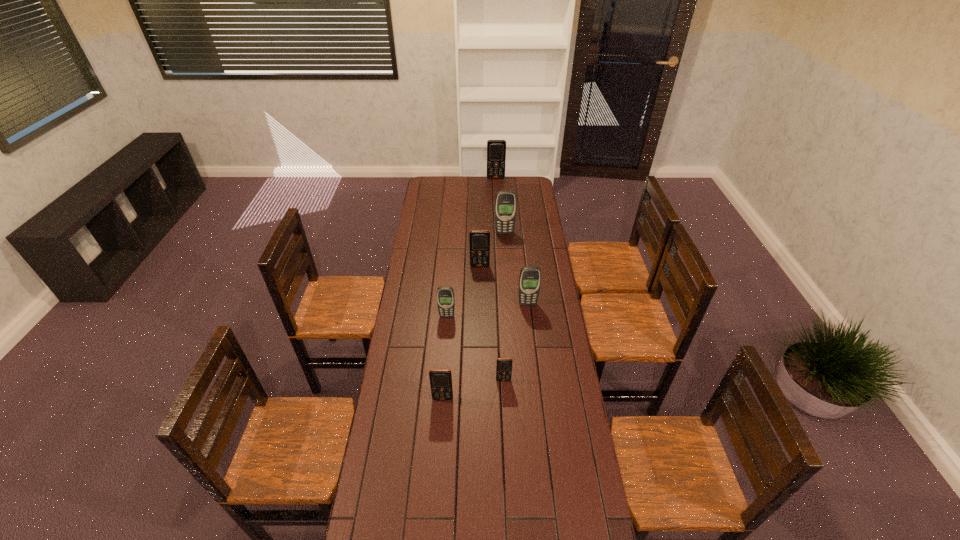
Where is `free space between the fourth nearest cellular telephone and the smallest orange cellular telephone`? free space between the fourth nearest cellular telephone and the smallest orange cellular telephone is located at coordinates (516, 342).

This screenshot has width=960, height=540. Find the location of `unoccupied area between the leftmost gray cellular telephone and the leftmost orange cellular telephone`. unoccupied area between the leftmost gray cellular telephone and the leftmost orange cellular telephone is located at coordinates (444, 357).

In order to click on empty location between the farthest cellular telephone and the second biggest orange cellular telephone in this screenshot , I will do `click(488, 222)`.

Find the location of a particular element. The image size is (960, 540). object that is the second closest one to the second farthest orange cellular telephone is located at coordinates (530, 276).

Where is `object that ranks as the closest to the farthest gray cellular telephone`? object that ranks as the closest to the farthest gray cellular telephone is located at coordinates (479, 239).

Image resolution: width=960 pixels, height=540 pixels. I want to click on cellular telephone that stands as the second closest to the biggest orange cellular telephone, so click(x=479, y=239).

Select which cellular telephone appears as the fourth closest to the third biggest orange cellular telephone. Please provide its 2D coordinates. Your answer should be formatted as a tuple, i.e. [(x, y)], where the tuple contains the x and y coordinates of a point satisfying the conditions above.

[(479, 239)]

Locate an element on the screen. orange cellular telephone that can be found as the fourth closest to the fourth farthest object is located at coordinates (496, 149).

Point out which orange cellular telephone is positioned as the nearest to the sixth nearest cellular telephone. Please provide its 2D coordinates. Your answer should be formatted as a tuple, i.e. [(x, y)], where the tuple contains the x and y coordinates of a point satisfying the conditions above.

[(479, 239)]

Locate an element on the screen. gray cellular telephone that is the second closest to the fourth farthest object is located at coordinates (505, 203).